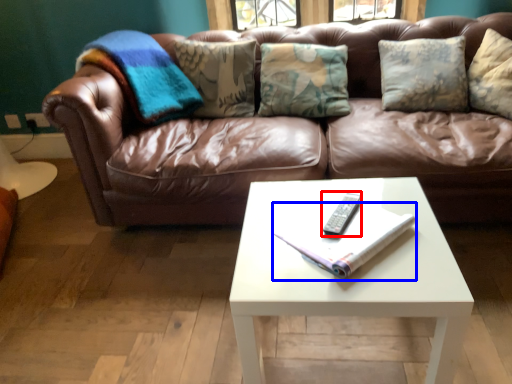
Question: Which point is further to the camera, remote (highlighted by a red box) or book (highlighted by a blue box)?

Choices:
 (A) remote
 (B) book

Answer: (A)